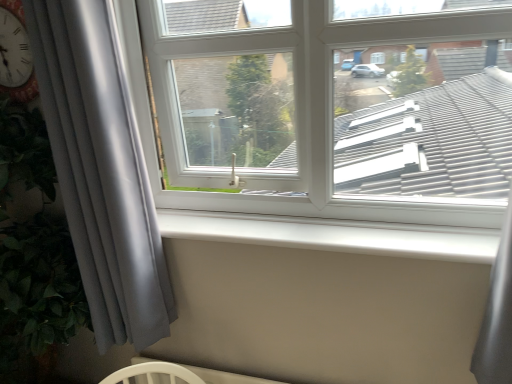
In order to face white plastic window at center, should I rotate leftwards or rightwards?

Turn right by 5.868 degrees to look at white plastic window at center.

Describe the element at coordinates (333, 108) in the screenshot. I see `white plastic window at center` at that location.

Where is `gray matte curtain at left`? This screenshot has width=512, height=384. gray matte curtain at left is located at coordinates (101, 170).

What do you see at coordinates (334, 235) in the screenshot?
I see `white smooth window sill at center` at bounding box center [334, 235].

This screenshot has width=512, height=384. In order to click on white plastic window at center in this screenshot , I will do `click(333, 108)`.

Considering the relative sizes of gray matte curtain at left and white plastic window at center in the image provided, is gray matte curtain at left thinner than white plastic window at center?

Yes.

From the image's perspective, is gray matte curtain at left over white plastic window at center?

No, from the image's perspective, gray matte curtain at left is not over white plastic window at center.

Which of these two, gray matte curtain at left or white plastic window at center, is smaller?

Smaller between the two is gray matte curtain at left.

Is white plastic window at center surrounded by gray matte curtain at left?

No, white plastic window at center is not inside gray matte curtain at left.

Which object is thinner, white plastic window at center or white smooth window sill at center?

Thinner between the two is white smooth window sill at center.

From the image's perspective, is white plastic window at center located above white smooth window sill at center?

Correct, white plastic window at center appears higher than white smooth window sill at center in the image.

Who is more distant, white plastic window at center or white smooth window sill at center?

white smooth window sill at center is more distant.

What's the angular difference between white plastic window at center and white smooth window sill at center's facing directions?

The angular difference between white plastic window at center and white smooth window sill at center is 1.32 degrees.

Are white smooth window sill at center and white plastic window at center located far from each other?

No, white smooth window sill at center is in close proximity to white plastic window at center.

Is white smooth window sill at center bigger or smaller than white plastic window at center?

white smooth window sill at center is smaller than white plastic window at center.

Is white smooth window sill at center oriented away from white plastic window at center?

That's not correct — white smooth window sill at center is not looking away from white plastic window at center.

The width and height of the screenshot is (512, 384). What are the coordinates of `window above the white smooth window sill at center (from a real-world perspective)` in the screenshot? It's located at (333, 108).

Does white plastic window at center have a greater width compared to gray matte curtain at left?

Indeed, white plastic window at center has a greater width compared to gray matte curtain at left.

How different are the orientations of white plastic window at center and gray matte curtain at left in degrees?

9.77 degrees separate the facing orientations of white plastic window at center and gray matte curtain at left.

Are white plastic window at center and gray matte curtain at left beside each other?

No, white plastic window at center is not next to gray matte curtain at left.

Which is closer, (x=373, y=20) or (x=117, y=168)?

Clearly, point (x=373, y=20) is closer to the camera than point (x=117, y=168).

Is white smooth window sill at center far from gray matte curtain at left?

No, there isn't a large distance between white smooth window sill at center and gray matte curtain at left.

Does white smooth window sill at center have a smaller size compared to gray matte curtain at left?

Correct, white smooth window sill at center occupies less space than gray matte curtain at left.

Is white smooth window sill at center to the left or to the right of gray matte curtain at left in the image?

From the image, it's evident that white smooth window sill at center is to the right of gray matte curtain at left.

Is white smooth window sill at center inside the boundaries of gray matte curtain at left, or outside?

white smooth window sill at center is not inside gray matte curtain at left, it's outside.

Is gray matte curtain at left shorter than white smooth window sill at center?

Incorrect, the height of gray matte curtain at left does not fall short of that of white smooth window sill at center.

Is the depth of gray matte curtain at left greater than that of white smooth window sill at center?

No, the depth of gray matte curtain at left is less than that of white smooth window sill at center.

From a real-world perspective, which object stands above the other?

gray matte curtain at left, from a real-world perspective.

Does gray matte curtain at left have a smaller size compared to white smooth window sill at center?

No.

Where is `window above the gray matte curtain at left (from a real-world perspective)`? The width and height of the screenshot is (512, 384). window above the gray matte curtain at left (from a real-world perspective) is located at coordinates (333, 108).

Find the location of `window in front of the white smooth window sill at center`. window in front of the white smooth window sill at center is located at coordinates (333, 108).

Looking at this image, from the image, which object appears to be nearer to white plastic window at center, gray matte curtain at left or white smooth window sill at center?

white smooth window sill at center.

Considering their positions, is white plastic window at center positioned further to gray matte curtain at left than white smooth window sill at center?

white plastic window at center lies further to gray matte curtain at left than the other object.

Looking at the image, which one is located further to white smooth window sill at center, white plastic window at center or gray matte curtain at left?

Among the two, gray matte curtain at left is located further to white smooth window sill at center.

From the image, which object appears to be farther from white plastic window at center, white smooth window sill at center or gray matte curtain at left?

gray matte curtain at left.

Based on their spatial positions, is white smooth window sill at center or white plastic window at center further from gray matte curtain at left?

white plastic window at center is further to gray matte curtain at left.

In the scene shown: Considering their positions, is gray matte curtain at left positioned further to white smooth window sill at center than white plastic window at center?

gray matte curtain at left.

You are a GUI agent. You are given a task and a screenshot of the screen. Output one action in this format:
    pyautogui.click(x=<x>, y=<y>)
    Task: Click on the window between gray matte curtain at left and white smooth window sill at center
    Image resolution: width=512 pixels, height=384 pixels.
    Given the screenshot: What is the action you would take?
    pyautogui.click(x=333, y=108)